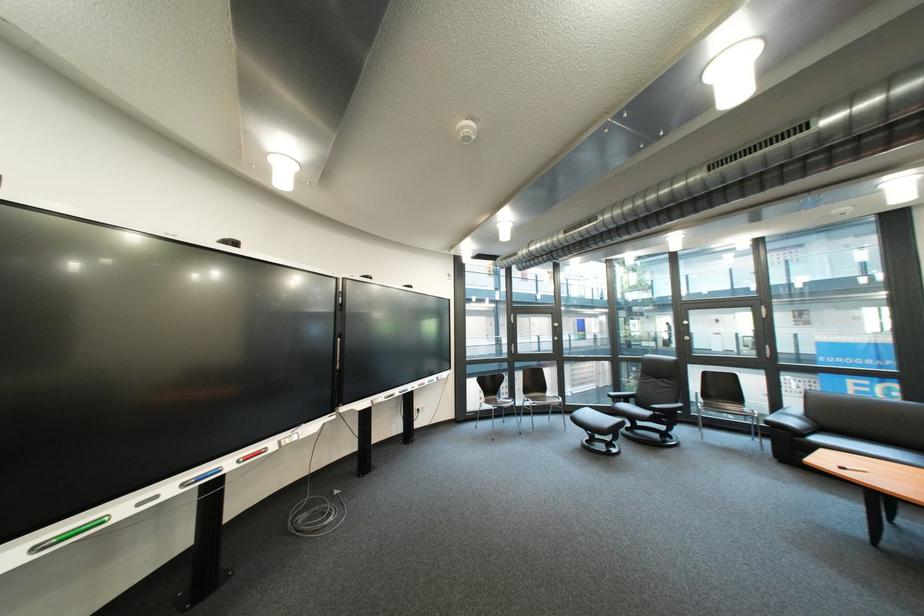
You are a GUI agent. You are given a task and a screenshot of the screen. Output one action in this format:
    pyautogui.click(x=<x>, y=<y>)
    Task: Click on the sofa armrest
    
    Given the screenshot: What is the action you would take?
    pyautogui.click(x=791, y=422)